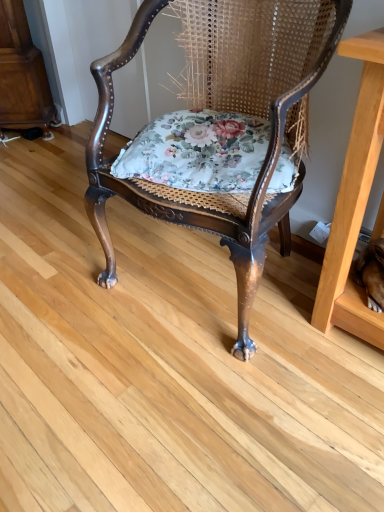
The image size is (384, 512). Identify the location of vacant region in front of polished wood chair at center. (210, 402).